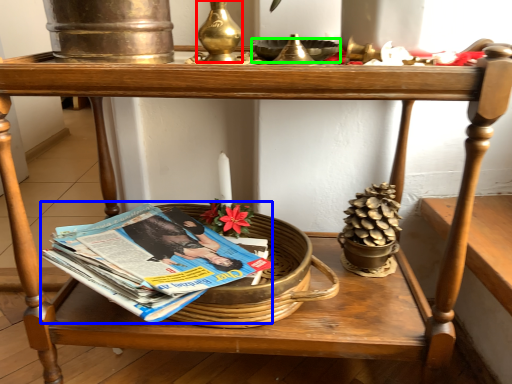
Question: Which is farther away from candle holder (highlighted by a red box)? paperback book (highlighted by a blue box) or bowl (highlighted by a green box)?

Choices:
 (A) paperback book
 (B) bowl

Answer: (A)